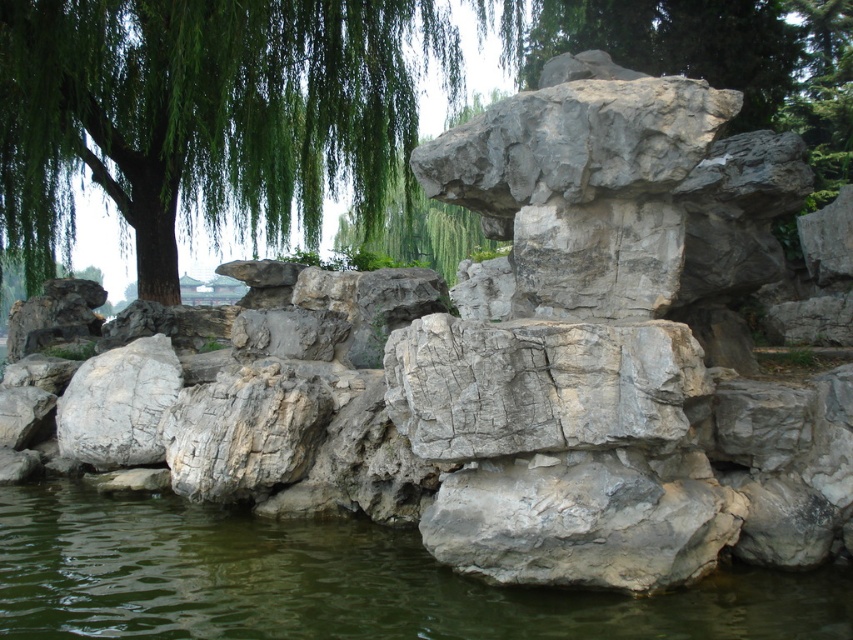
Question: Can you confirm if green leafy willow at upper left is thinner than green water at lower center?

Choices:
 (A) yes
 (B) no

Answer: (A)

Question: Is green leafy willow at upper left below green water at lower center?

Choices:
 (A) yes
 (B) no

Answer: (B)

Question: Among these objects, which one is farthest from the camera?

Choices:
 (A) green leafy willow at upper left
 (B) green water at lower center

Answer: (A)

Question: Is green leafy willow at upper left to the left of green water at lower center from the viewer's perspective?

Choices:
 (A) yes
 (B) no

Answer: (A)

Question: Which object is farther from the camera taking this photo?

Choices:
 (A) green water at lower center
 (B) green leafy willow at upper left

Answer: (B)